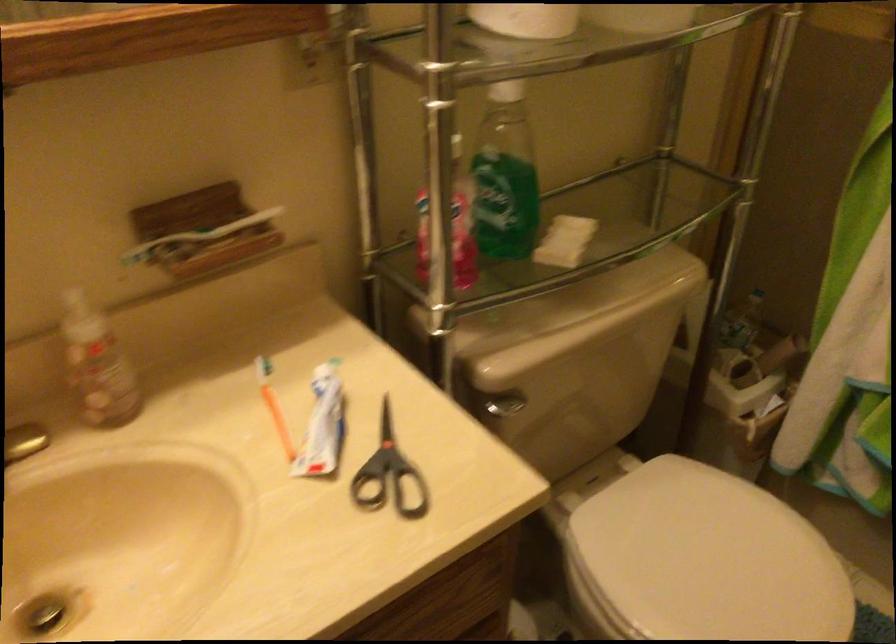
Find where to lift the empty cardboard roll. Please return your answer as a coordinate pair (x, y).

(708, 236)